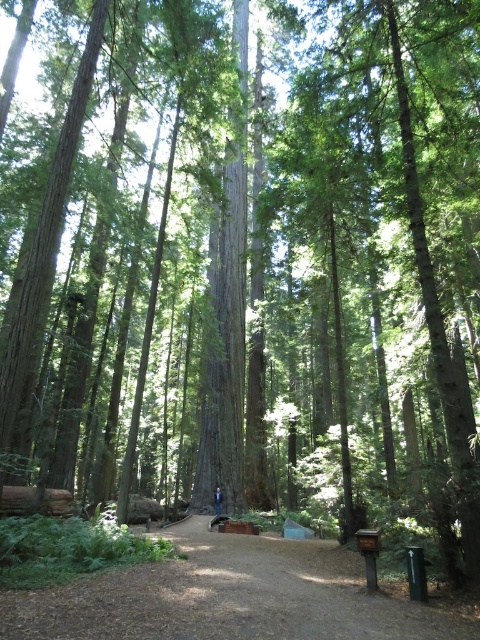
Is brown dirt path at center above blue jeans at center?

Yes, brown dirt path at center is above blue jeans at center.

Who is more forward, (394, 589) or (216, 513)?

Point (394, 589) is more forward.

Who is more forward, (75, 632) or (219, 492)?

Point (75, 632) is in front.

Find the location of a particular element. The width and height of the screenshot is (480, 640). brown dirt path at center is located at coordinates (231, 596).